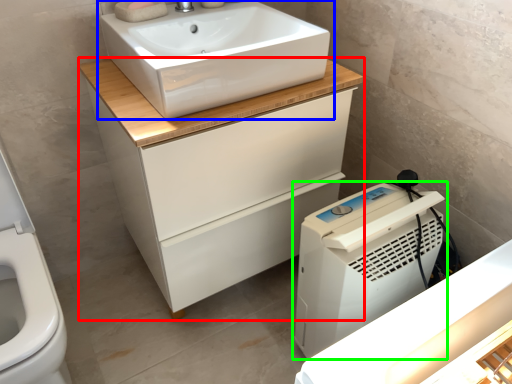
Question: Based on their relative distances, which object is farther from bathroom cabinet (highlighted by a red box)? Choose from sink (highlighted by a blue box) and home appliance (highlighted by a green box).

Choices:
 (A) sink
 (B) home appliance

Answer: (B)